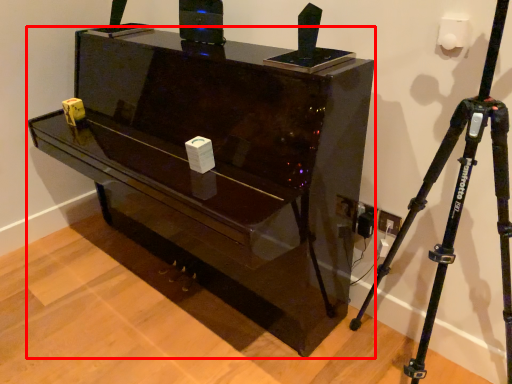
Question: From the image's perspective, what is the correct spatial relationship of furniture (annotated by the red box) in relation to tripod?

Choices:
 (A) below
 (B) above

Answer: (B)